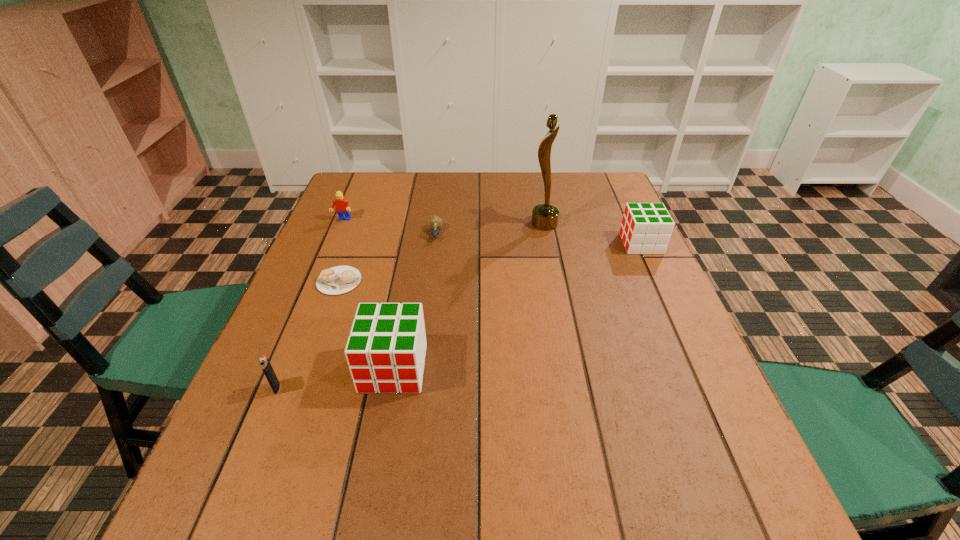
In the image, there is a desktop. What are the coordinates of `free space at the far right corner` in the screenshot? It's located at (570, 179).

Where is `free space between the second object from right to left and the Lego`? This screenshot has height=540, width=960. free space between the second object from right to left and the Lego is located at coordinates (444, 222).

Where is `free point between the fifth farthest object and the igniter`? The image size is (960, 540). free point between the fifth farthest object and the igniter is located at coordinates (308, 334).

This screenshot has height=540, width=960. Find the location of `empty location between the shorter cube and the award`. empty location between the shorter cube and the award is located at coordinates (593, 234).

You are a GUI agent. You are given a task and a screenshot of the screen. Output one action in this format:
    pyautogui.click(x=<x>, y=<y>)
    Task: Click on the free area in between the award and the Lego
    The height and width of the screenshot is (540, 960).
    Given the screenshot: What is the action you would take?
    pyautogui.click(x=444, y=222)

Identify the location of free spot between the Lego and the escargot. (390, 227).

This screenshot has height=540, width=960. I want to click on free space between the farther cube and the Lego, so click(x=492, y=232).

At what (x,y) coordinates should I click in order to perform the action: click on vacant space that's between the Lego and the shortest object. Please return your answer as a coordinate pair (x, y). The height and width of the screenshot is (540, 960). Looking at the image, I should click on (341, 251).

This screenshot has height=540, width=960. Find the location of `object that stands as the third closest to the igniter`. object that stands as the third closest to the igniter is located at coordinates (436, 222).

Where is `object that is the third closest one to the Lego`? The image size is (960, 540). object that is the third closest one to the Lego is located at coordinates (386, 349).